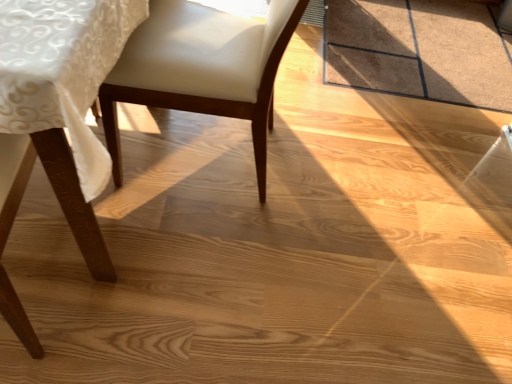
Find the location of a particular element. The height and width of the screenshot is (384, 512). empty space that is to the right of white leather chair at center, the 1th chair from the right is located at coordinates (332, 188).